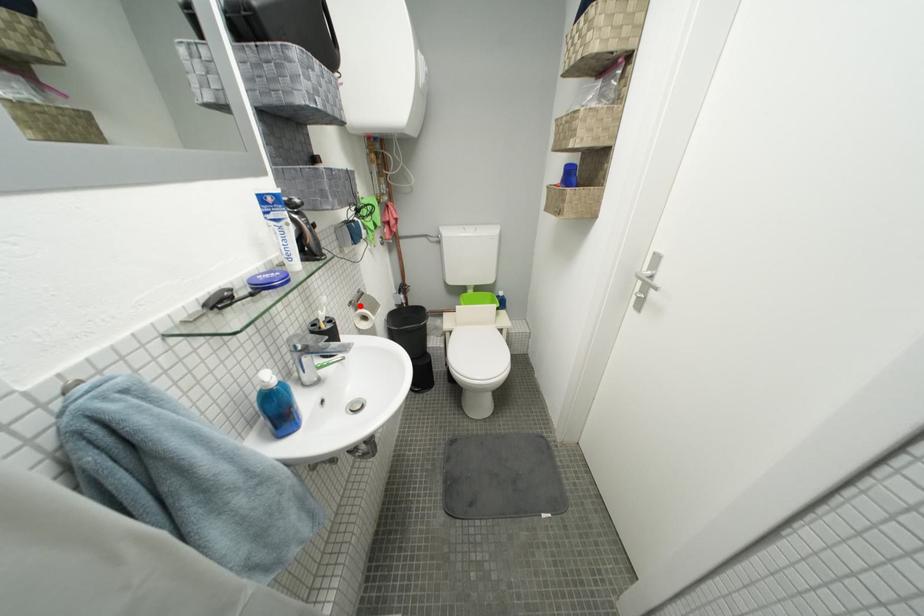
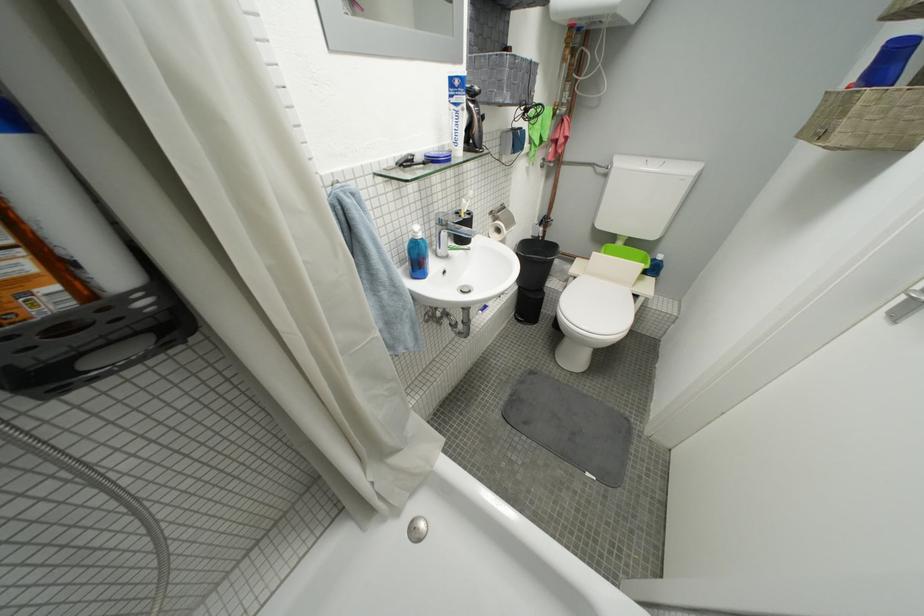
In the second image, find the point that corresponds to the highlighted location in the first image.

(500, 214)